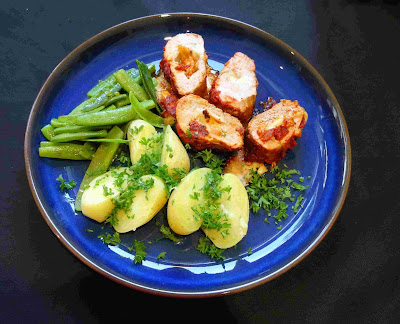
Identify the location of rim of plate. (274, 278).